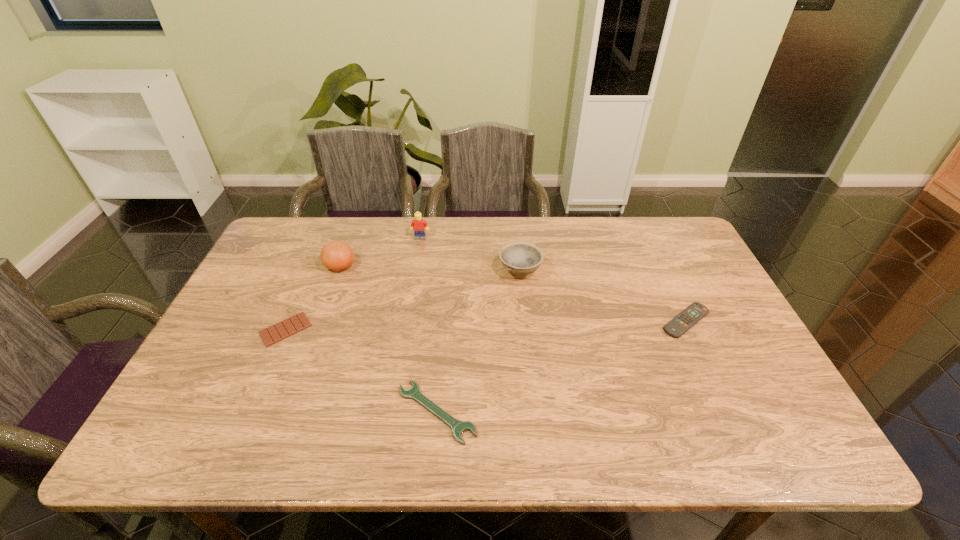
You are a GUI agent. You are given a task and a screenshot of the screen. Output one action in this format:
    pyautogui.click(x=<x>, y=<y>)
    Task: Click on the vacant area that lies between the candy bar and the clementine
    The image size is (960, 540).
    Given the screenshot: What is the action you would take?
    pyautogui.click(x=313, y=298)

Identify the location of free spot between the candy bar and the rightmost object. (486, 325).

Locate an element on the screen. The image size is (960, 540). free space between the wrench and the farthest object is located at coordinates (x=428, y=325).

Find the location of a particular element. This screenshot has height=540, width=960. free point between the second tallest object and the third tallest object is located at coordinates (430, 268).

Identify the location of vacant point located between the third tallest object and the nearest object. Image resolution: width=960 pixels, height=540 pixels. (478, 341).

The height and width of the screenshot is (540, 960). Identify the location of unoccupied position between the shortest object and the second object from right to left. pos(403,300).

This screenshot has height=540, width=960. I want to click on blank region between the clementine and the remote control, so click(x=513, y=294).

Identify the location of object that is the second nearest to the shortest object. This screenshot has height=540, width=960. [x=458, y=427].

Select which object is the fifth closest to the tallest object. Please provide its 2D coordinates. Your answer should be formatted as a tuple, i.e. [(x, y)], where the tuple contains the x and y coordinates of a point satisfying the conditions above.

[(680, 324)]